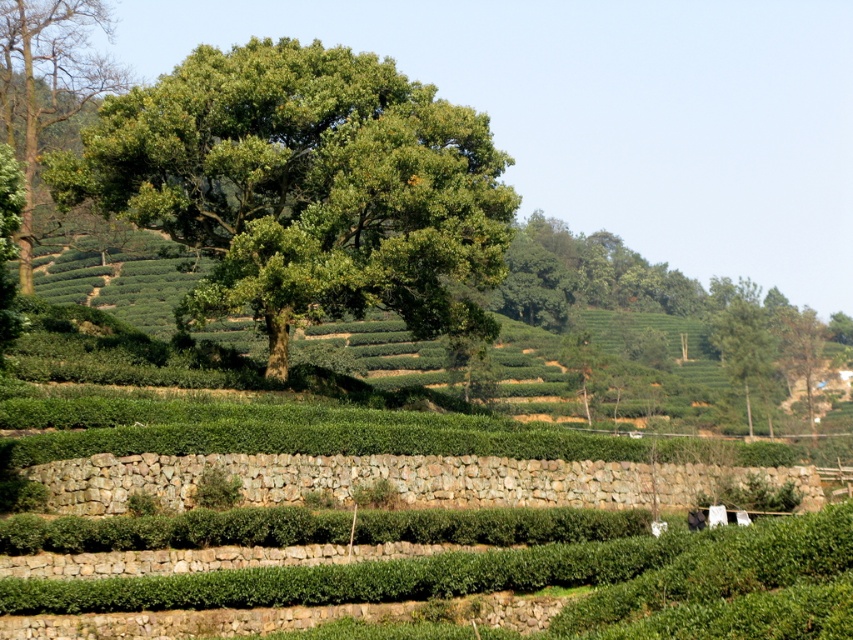
Is green leafy tree at center to the right of green leafy tree at upper left from the viewer's perspective?

Indeed, green leafy tree at center is positioned on the right side of green leafy tree at upper left.

Is point (242, 51) less distant than point (71, 90)?

Yes, point (242, 51) is closer to viewer.

The width and height of the screenshot is (853, 640). Find the location of `green leafy tree at center`. green leafy tree at center is located at coordinates point(305,188).

This screenshot has height=640, width=853. What are the coordinates of `green leafy tree at center` in the screenshot? It's located at point(305,188).

Is point (476, 243) positioned after point (730, 320)?

That is False.

Is green leafy tree at center smaller than green leafy tree at upper right?

Correct, green leafy tree at center occupies less space than green leafy tree at upper right.

You are a GUI agent. You are given a task and a screenshot of the screen. Output one action in this format:
    pyautogui.click(x=<x>, y=<y>)
    Task: Click on the green leafy tree at center
    The image size is (853, 640).
    Given the screenshot: What is the action you would take?
    pyautogui.click(x=305, y=188)

Locate an element on the screen. The width and height of the screenshot is (853, 640). green leafy tree at center is located at coordinates (305, 188).

Is point (93, 51) less distant than point (741, 298)?

Yes, it is.

Image resolution: width=853 pixels, height=640 pixels. Identify the location of green leafy tree at upper left. (45, 86).

The width and height of the screenshot is (853, 640). I want to click on green leafy tree at upper left, so click(45, 86).